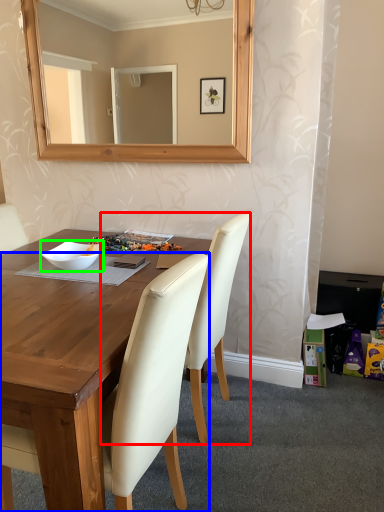
Question: Estimate the real-world distances between objects in this image. Which object is farther from chair (highlighted by a red box), chair (highlighted by a blue box) or bowl (highlighted by a green box)?

Choices:
 (A) chair
 (B) bowl

Answer: (B)